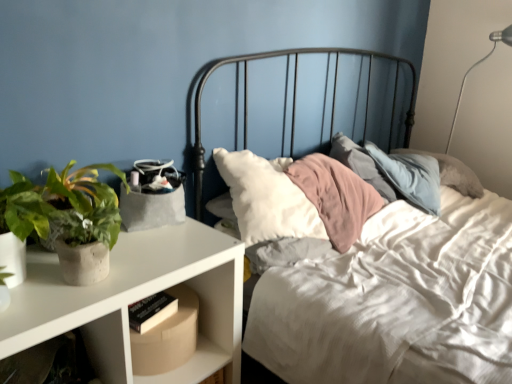
Question: From the image's perspective, is green matte plant at left located above cardboard box at lower left?

Choices:
 (A) yes
 (B) no

Answer: (A)

Question: Considering the relative sizes of green matte plant at left and cardboard box at lower left in the image provided, is green matte plant at left shorter than cardboard box at lower left?

Choices:
 (A) yes
 (B) no

Answer: (B)

Question: Is green matte plant at left smaller than cardboard box at lower left?

Choices:
 (A) no
 (B) yes

Answer: (A)

Question: From the image's perspective, is green matte plant at left below cardboard box at lower left?

Choices:
 (A) no
 (B) yes

Answer: (A)

Question: Is green matte plant at left turned away from cardboard box at lower left?

Choices:
 (A) yes
 (B) no

Answer: (B)

Question: In terms of width, does green matte plant at left look wider or thinner when compared to cardboard box at lower left?

Choices:
 (A) wide
 (B) thin

Answer: (B)

Question: From the image's perspective, is green matte plant at left located above or below cardboard box at lower left?

Choices:
 (A) above
 (B) below

Answer: (A)

Question: Considering their positions, is green matte plant at left located in front of or behind cardboard box at lower left?

Choices:
 (A) front
 (B) behind

Answer: (A)

Question: From a real-world perspective, is green matte plant at left above or below cardboard box at lower left?

Choices:
 (A) above
 (B) below

Answer: (A)

Question: Relative to cardboard box at lower left, is white matte nightstand at left in front or behind?

Choices:
 (A) behind
 (B) front

Answer: (B)

Question: Is white matte nightstand at left wider or thinner than cardboard box at lower left?

Choices:
 (A) wide
 (B) thin

Answer: (A)

Question: Is white matte nightstand at left taller or shorter than cardboard box at lower left?

Choices:
 (A) tall
 (B) short

Answer: (A)

Question: Considering the relative positions of white matte nightstand at left and cardboard box at lower left in the image provided, is white matte nightstand at left to the left or to the right of cardboard box at lower left?

Choices:
 (A) left
 (B) right

Answer: (A)

Question: Looking at their shapes, would you say cardboard box at lower left is wider or thinner than green matte plant at left?

Choices:
 (A) wide
 (B) thin

Answer: (A)

Question: Is cardboard box at lower left bigger or smaller than green matte plant at left?

Choices:
 (A) big
 (B) small

Answer: (B)